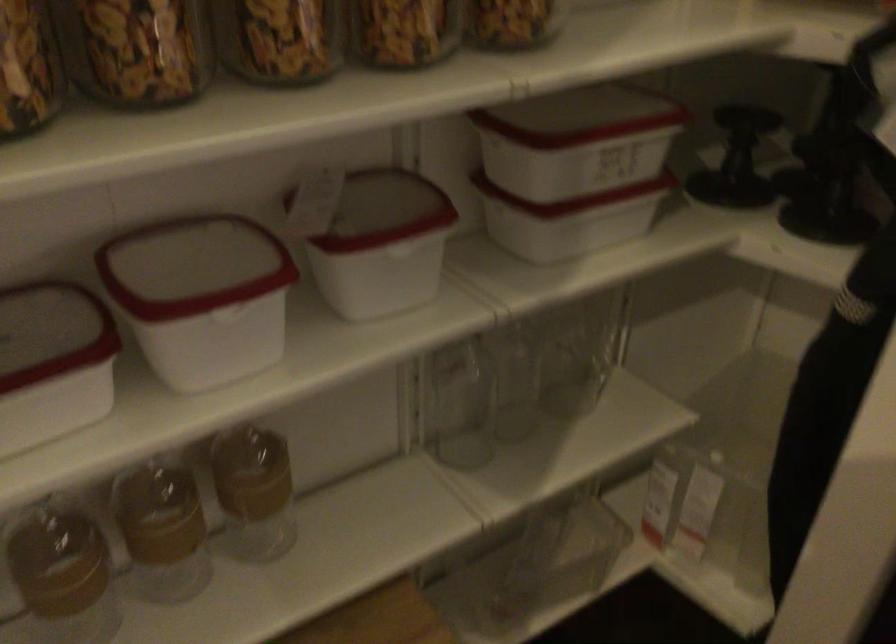
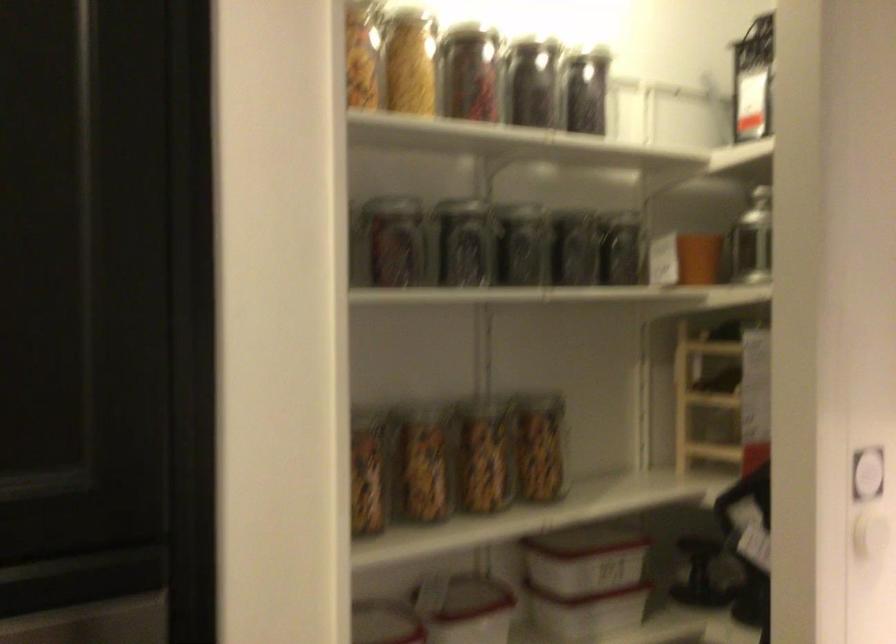
Find the pixel in the second image that matches the point at 238,243 in the first image.

(383, 623)